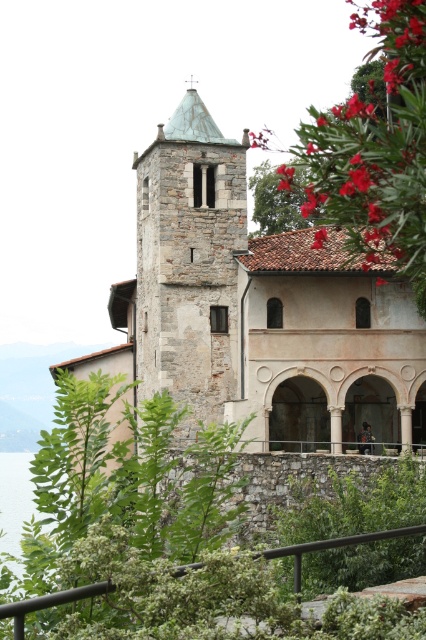
Question: Can you confirm if stone church at center is smaller than green leafy plant at center?

Choices:
 (A) yes
 (B) no

Answer: (A)

Question: Does green leafy plant at center appear under transparent water at lower left?

Choices:
 (A) yes
 (B) no

Answer: (B)

Question: Which object is positioned closest to the transparent water at lower left?

Choices:
 (A) green leafy plant at center
 (B) black metal/rail at lower center
 (C) stone church at center

Answer: (C)

Question: Which of these objects is positioned closest to the black metal/rail at lower center?

Choices:
 (A) stone church at center
 (B) transparent water at lower left
 (C) red matte flower at upper right

Answer: (A)

Question: Based on their relative distances, which object is nearer to the transparent water at lower left?

Choices:
 (A) red matte flower at upper right
 (B) green leafy plant at center

Answer: (B)

Question: Can you confirm if red matte flower at upper right is smaller than transparent water at lower left?

Choices:
 (A) no
 (B) yes

Answer: (A)